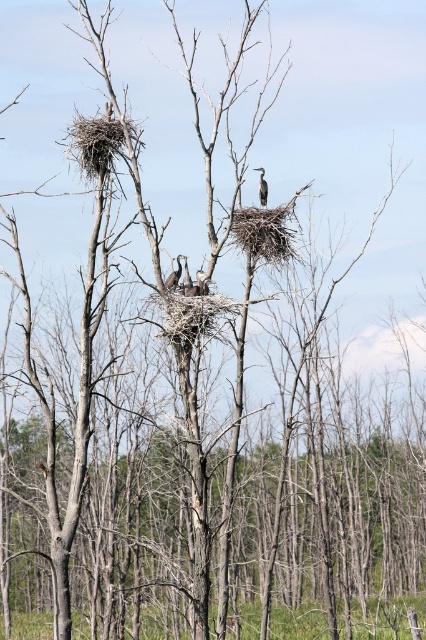
You are a birdwatcher observing the scene from a distance. You notice a brown textured bird at center and a brown textured nest at center. Which object is closer to you?

The brown textured bird at center is closer to you because it is further to the viewer than the brown textured nest at center.